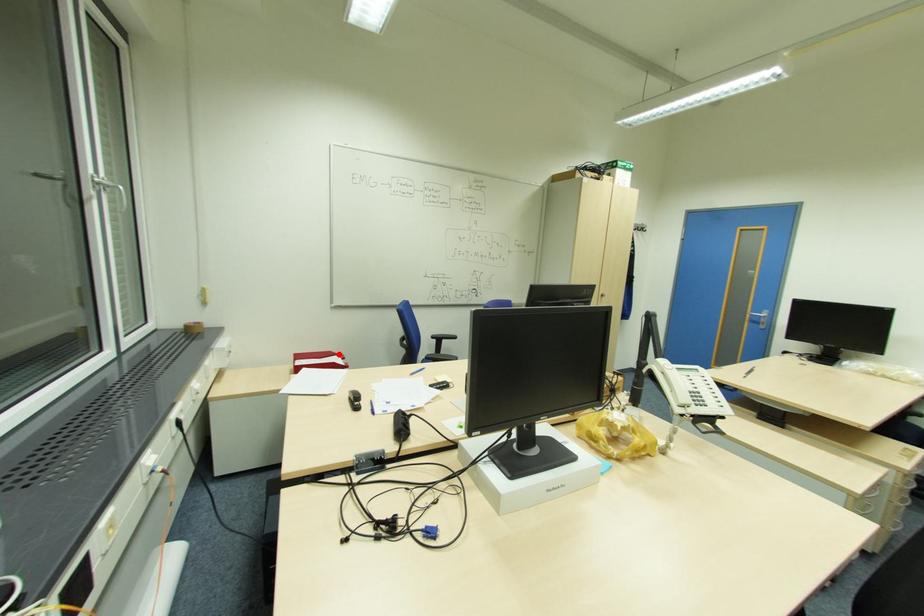
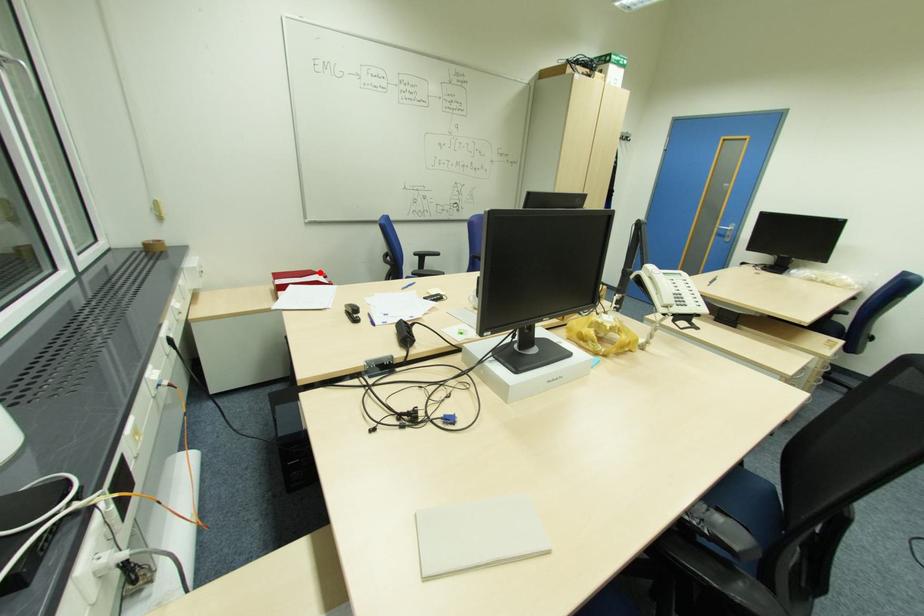
I am providing you with two images of the same scene from different viewpoints. A red point is marked on the first image and another point is marked on the second image. Is the red point in image1 aligned with the point shown in image2?

Yes